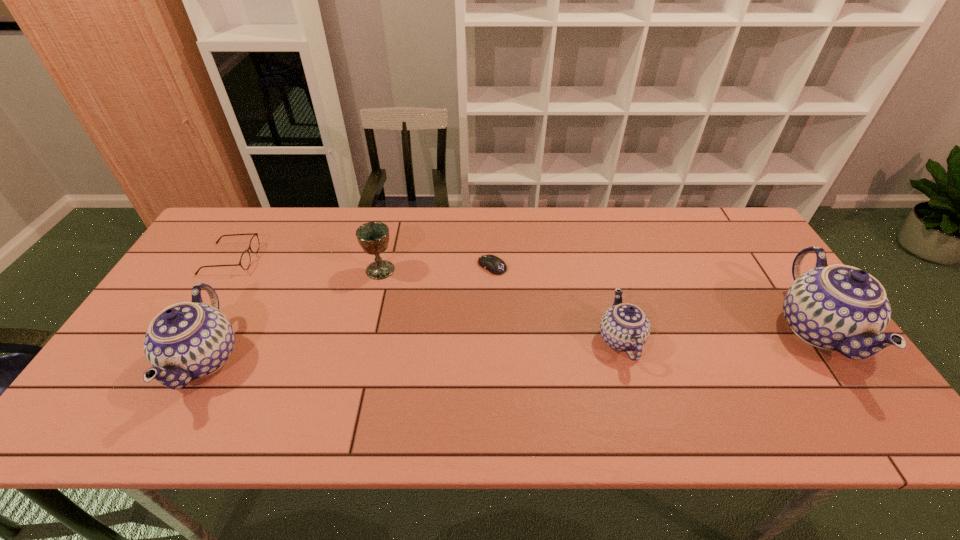
In the image, there is a desktop. Where is `vacant space at the far right corner`? vacant space at the far right corner is located at coordinates (742, 246).

Where is `free spot between the fifth tallest object and the rightmost object`? This screenshot has height=540, width=960. free spot between the fifth tallest object and the rightmost object is located at coordinates [523, 294].

At what (x,y) coordinates should I click in order to perform the action: click on unoccupied position between the rightmost chinaware and the shortest object. Please return your answer as a coordinate pair (x, y). Looking at the image, I should click on (655, 298).

The width and height of the screenshot is (960, 540). What are the coordinates of `vacant space that's between the chalice and the spectacles` in the screenshot? It's located at (305, 265).

Image resolution: width=960 pixels, height=540 pixels. In order to click on vacant region between the shortest object and the shortest chinaware in this screenshot , I will do `click(557, 303)`.

Find the location of a particular element. The image size is (960, 540). vacant area that lies between the rightmost object and the shortest object is located at coordinates (655, 298).

Identify the location of empty space between the rightmost chinaware and the shortest object. (655, 298).

This screenshot has width=960, height=540. Identify the location of vacant space that is in between the second chinaware from left to right and the computer equipment. (557, 303).

I want to click on free space between the third shortest object and the chalice, so click(500, 305).

The height and width of the screenshot is (540, 960). I want to click on free space between the second shortest object and the fifth object from left to right, so click(x=425, y=299).